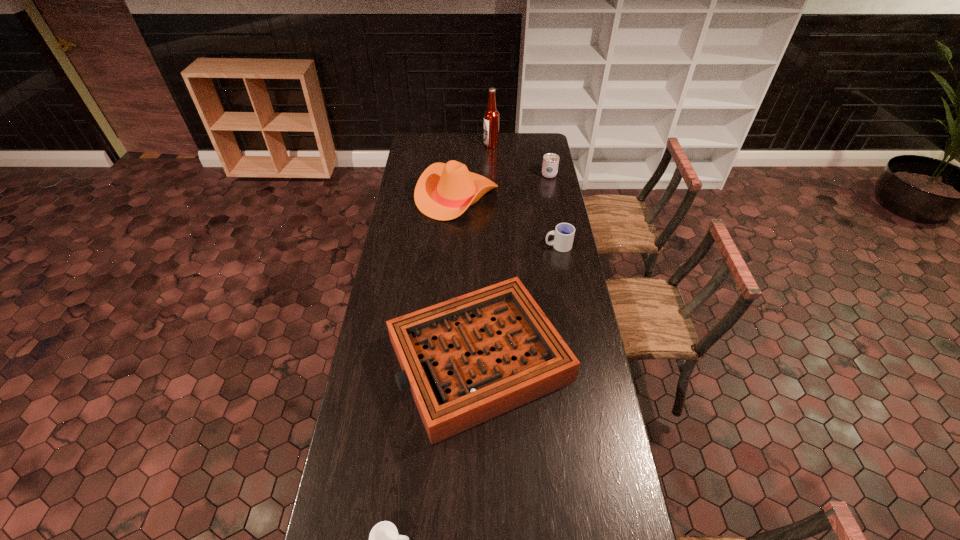
Image resolution: width=960 pixels, height=540 pixels. Identify the location of vacant area situated 0.060m on the label side of the alcohol. (473, 145).

At what (x,y) coordinates should I click in order to perform the action: click on vacant space located 0.220m on the front of the cowboy hat. Please return your answer as a coordinate pair (x, y). Looking at the image, I should click on point(453,254).

Locate an element on the screen. Image resolution: width=960 pixels, height=540 pixels. free space located 0.140m on the side with the handle of the tallest cup is located at coordinates (545, 154).

Find the location of a particular element. The image size is (960, 540). vacant space situated 0.280m on the side with the handle of the tallest cup is located at coordinates (542, 142).

This screenshot has height=540, width=960. I want to click on vacant space located 0.390m on the side with the handle of the tallest cup, so click(x=540, y=133).

Locate an element on the screen. The height and width of the screenshot is (540, 960). free region located on the back of the gameboard is located at coordinates (479, 256).

Locate an element on the screen. The width and height of the screenshot is (960, 540). free location located with the handle on the side of the fourth farthest object is located at coordinates (464, 246).

Locate an element on the screen. This screenshot has height=540, width=960. free space located 0.400m with the handle on the side of the fourth farthest object is located at coordinates tap(457, 246).

Find the location of `free spot located with the handle on the side of the fourth farthest object`. free spot located with the handle on the side of the fourth farthest object is located at coordinates (481, 246).

Identify the location of object positioned at the far edge. (491, 116).